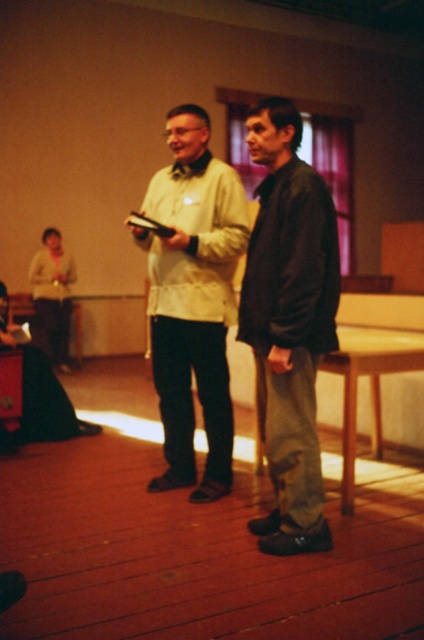
In the scene shown: Is the position of dark brown leather jacket at center more distant than that of matte beige jacket at center?

No, dark brown leather jacket at center is in front of matte beige jacket at center.

Consider the image. Can you confirm if dark brown leather jacket at center is positioned below matte beige jacket at center?

Indeed, dark brown leather jacket at center is positioned under matte beige jacket at center.

This screenshot has height=640, width=424. In order to click on dark brown leather jacket at center in this screenshot , I will do `click(290, 323)`.